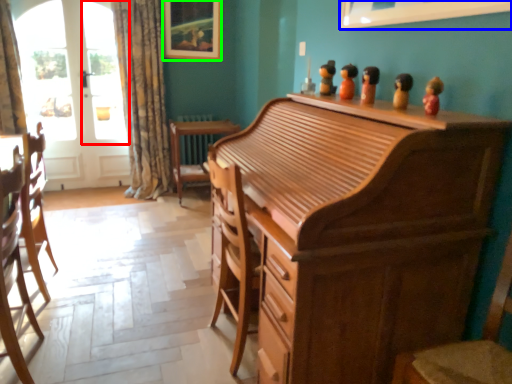
Question: Which object is positioned closest to window screen (highlighted by a red box)? Select from picture frame (highlighted by a blue box) and picture frame (highlighted by a green box).

Choices:
 (A) picture frame
 (B) picture frame

Answer: (B)